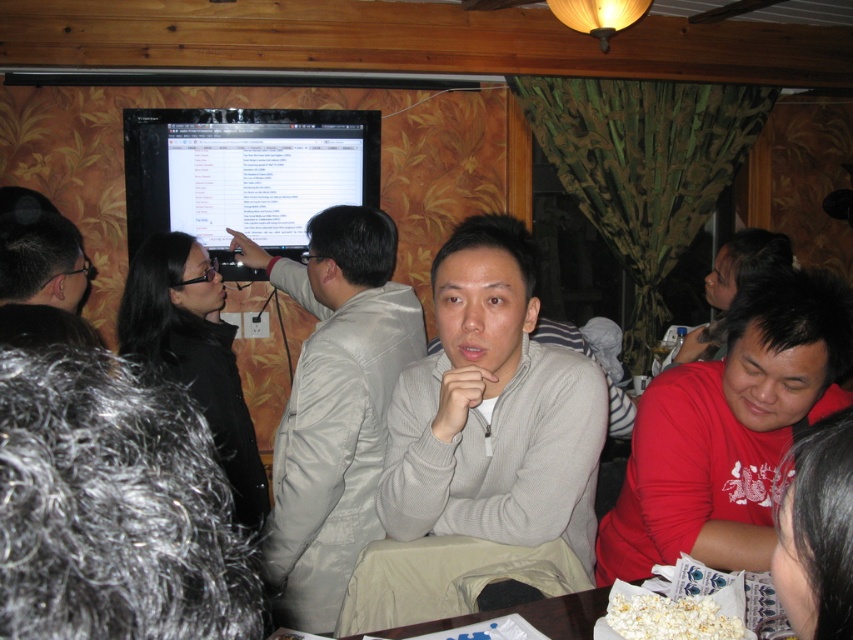
You are a guest at the gathering and want to place your napkin on the table. The satin beige jacket at center is blocking access to the white paper plate at lower center. Which direction should you move the jacket to clear space for the plate?

The satin beige jacket at center is to the left of the white paper plate at lower center. To clear space for the plate, you should move the jacket to the right.

You are a photographer standing in the room and want to take a photo of the satin beige jacket at center and the matte black monitor at upper left. Which object should you focus on first to ensure both are in sharp focus?

The satin beige jacket at center is closer to the viewer than the matte black monitor at upper left. To ensure both are in sharp focus, focus on the satin beige jacket at center first, as it is closer, and the monitor will fall within the depth of field.

You are standing at the center of the room and want to reach both the red matte shirt at lower right and the matte black monitor at upper left. Which object is closer to you?

The red matte shirt at lower right is closer to you since it is only 6.22 feet away from the matte black monitor at upper left, and you are at the center of the room.